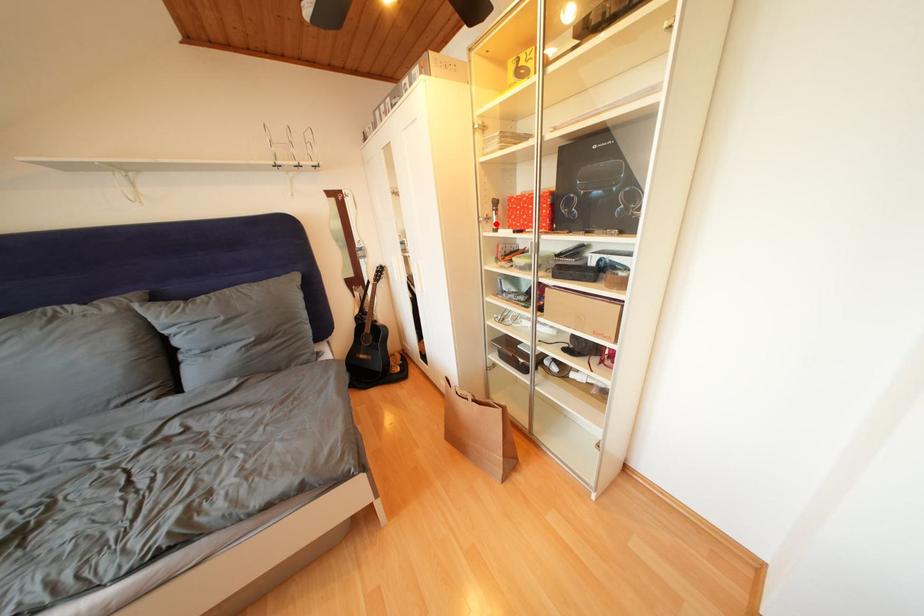
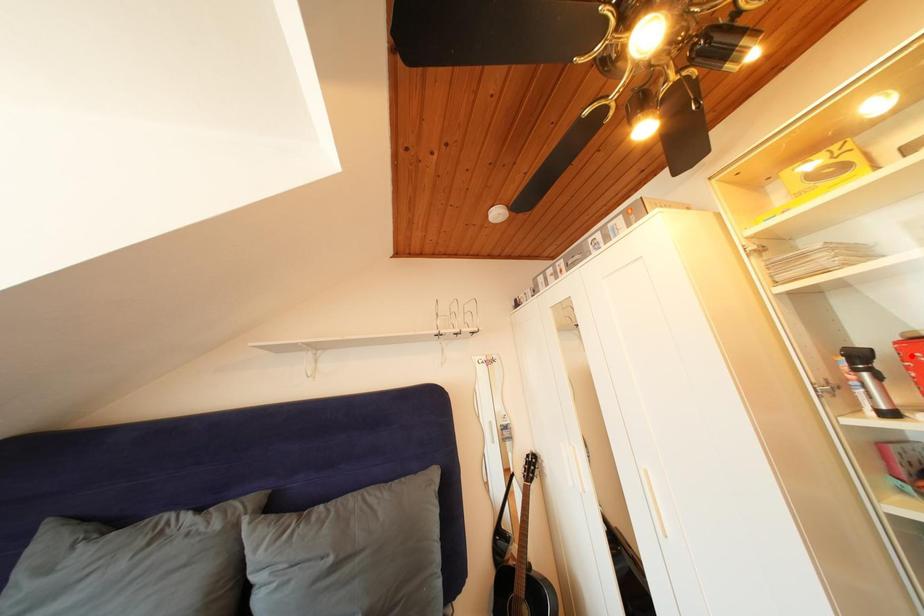
I am providing you with two images of the same scene from different viewpoints. A red point is marked on the first image and another point is marked on the second image. Is the red point in image1 aligned with the point shown in image2?

No